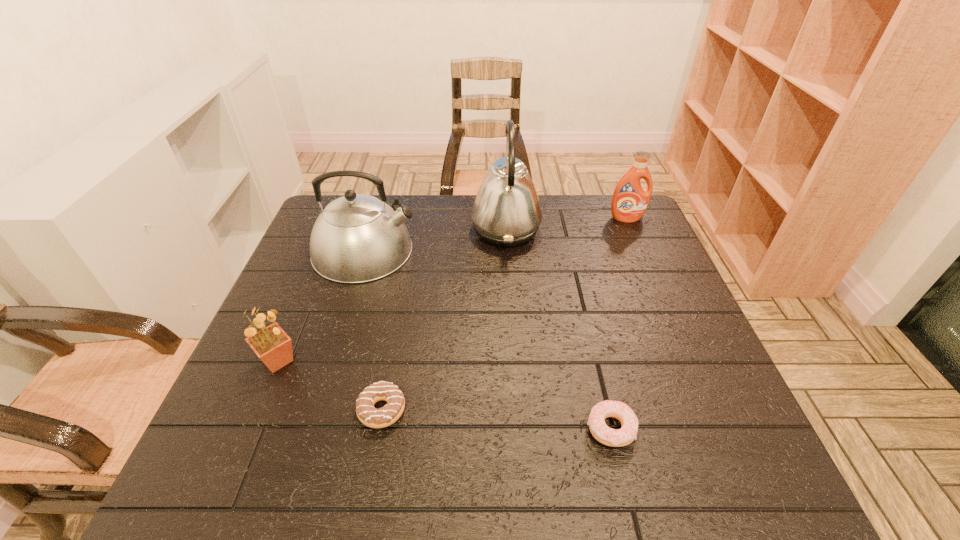
In order to click on empty space between the left kettle and the right doughnut in this screenshot , I will do `click(488, 340)`.

This screenshot has height=540, width=960. Find the location of `empty space between the fourth farthest object and the right doughnut`. empty space between the fourth farthest object and the right doughnut is located at coordinates (444, 395).

The image size is (960, 540). Identify the location of free point between the left doughnut and the fourth tallest object. (330, 385).

Find the location of `vacant space that's between the left doughnut and the right kettle`. vacant space that's between the left doughnut and the right kettle is located at coordinates (444, 320).

Image resolution: width=960 pixels, height=540 pixels. Identify the location of blank region between the sunflower and the left doughnut. (330, 385).

The height and width of the screenshot is (540, 960). In order to click on free area in between the left kettle and the fifth object from left to right in this screenshot , I will do `click(488, 340)`.

The image size is (960, 540). In order to click on vacant region between the fourth farthest object and the left doughnut in this screenshot , I will do `click(330, 385)`.

Locate an element on the screen. This screenshot has height=540, width=960. unoccupied position between the tallest object and the sunflower is located at coordinates (392, 295).

The width and height of the screenshot is (960, 540). Identify the location of vacant area between the left kettle and the left doughnut. (373, 330).

Locate an element on the screen. This screenshot has height=540, width=960. the fifth closest object relative to the taller kettle is located at coordinates (273, 346).